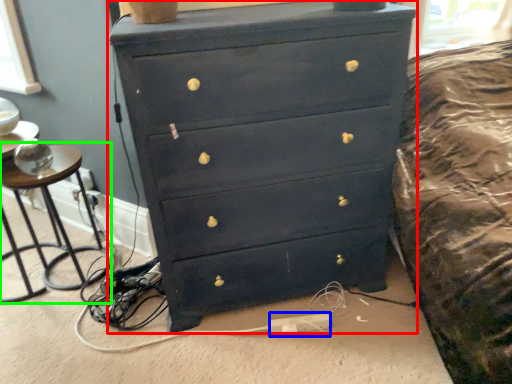
Question: Estimate the real-world distances between objects in this image. Which object is closer to chest of drawers (highlighted by a red box), extension cord (highlighted by a blue box) or side table (highlighted by a green box)?

Choices:
 (A) extension cord
 (B) side table

Answer: (A)